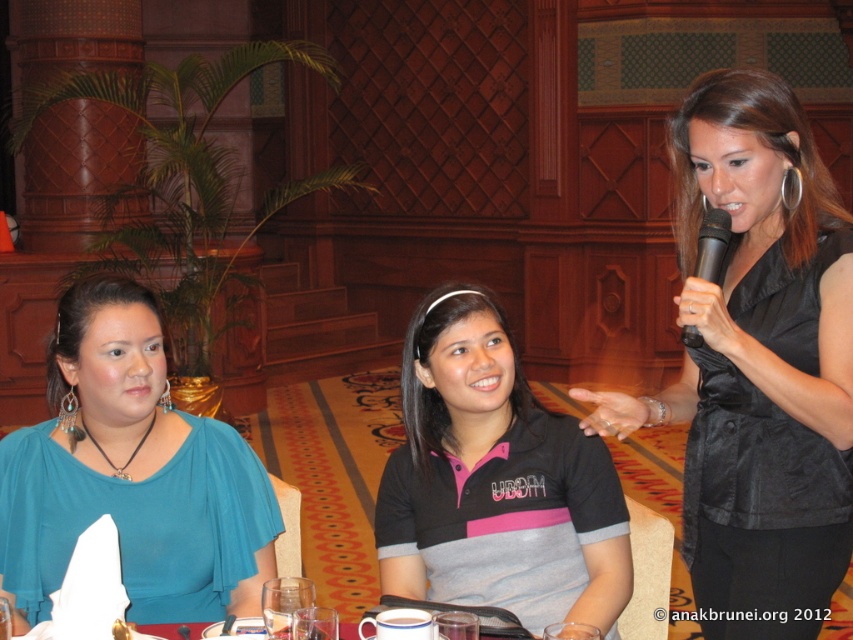
Consider the image. You are an event planner arranging seating for a photo shoot. You need to ensure that the black satin vest at upper right and the teal fabric blouse at left are visible in the frame. Considering their widths, which one might require more space to fully capture in the photo?

The teal fabric blouse at left has a greater width than the black satin vest at upper right, so it would require more space to fully capture in the photo.

You are observing a formal event and notice two attendees wearing the teal fabric blouse at left and the black matte polo shirt at center. Based on their positions, which clothing item is positioned higher in the image?

The teal fabric blouse at left is located above the black matte polo shirt at center, so it is positioned higher in the image.

You are attending a formal event and need to take a photo of the attendees. The teal fabric blouse at left and the black matte polo shirt at center are in your camera frame. Which one is positioned further away from the camera?

The black matte polo shirt at center is positioned further away from the camera because it is behind the teal fabric blouse at left.